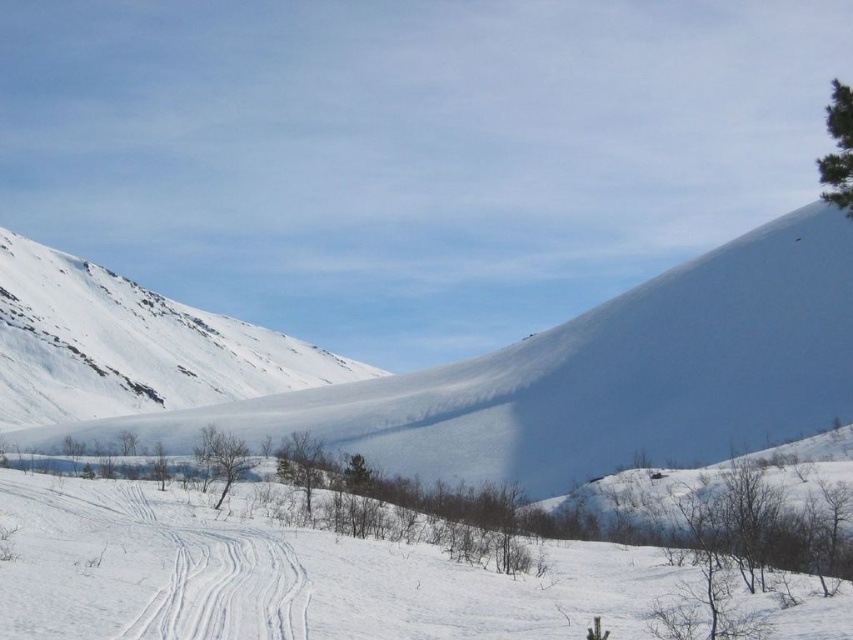
Question: Can you confirm if white snow-covered mountain at left is bigger than white snow ski slope at lower center?

Choices:
 (A) yes
 (B) no

Answer: (A)

Question: Which of the following is the farthest from the observer?

Choices:
 (A) white snow ski slope at lower center
 (B) white snow-covered mountain at left

Answer: (B)

Question: Is white snow-covered mountain at left above white snow ski slope at lower center?

Choices:
 (A) yes
 (B) no

Answer: (A)

Question: Can you confirm if white snow-covered mountain at left is positioned below white snow ski slope at lower center?

Choices:
 (A) no
 (B) yes

Answer: (A)

Question: Among these objects, which one is nearest to the camera?

Choices:
 (A) white snow-covered mountain at left
 (B) white snow ski slope at lower center

Answer: (B)